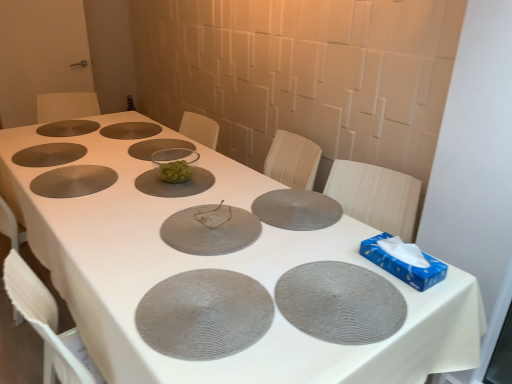
Identify the location of vacant space that is in between matte gray glass plate at center, placed as the third glass plate when sorted from front to back, and clear glass bowl at center, marked as the 6th glass plate in a front-to-back arrangement. (183, 197).